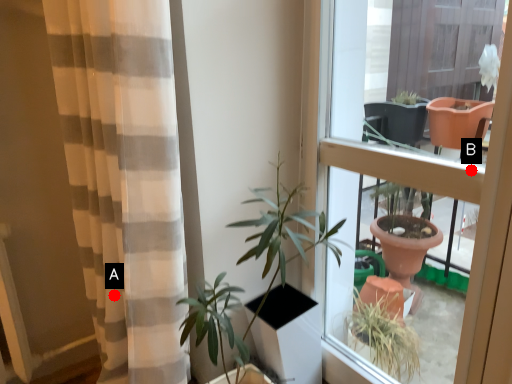
Question: Two points are circled on the image, labeled by A and B beside each circle. Which point is closer to the camera?

Choices:
 (A) A is closer
 (B) B is closer

Answer: (B)